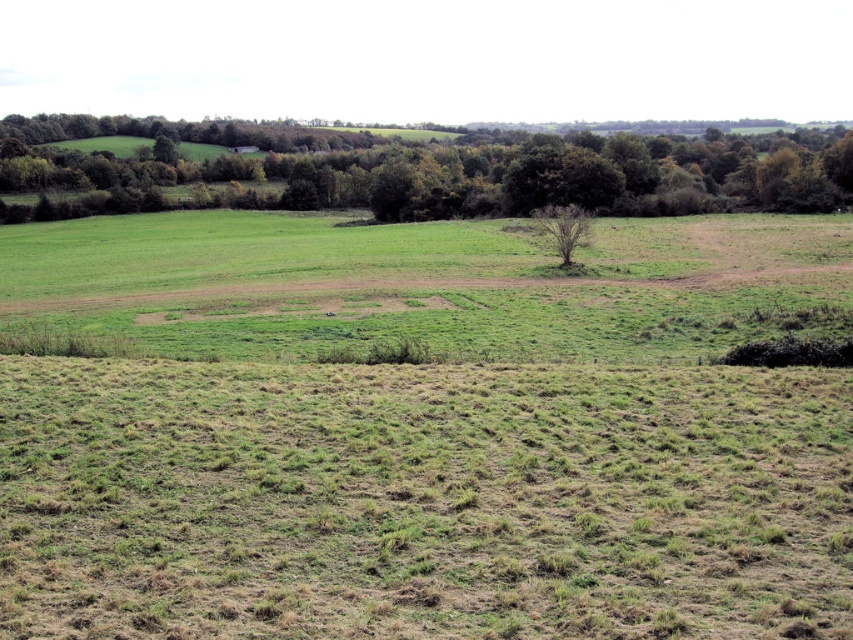
Question: Observing the image, what is the correct spatial positioning of green leafy tree at upper center in reference to bare brown tree at center?

Choices:
 (A) left
 (B) right

Answer: (B)

Question: Which point is closer to the camera?

Choices:
 (A) green leafy tree at upper center
 (B) bare brown tree at center

Answer: (B)

Question: Which point is farther to the camera?

Choices:
 (A) bare brown tree at center
 (B) green leafy tree at upper center

Answer: (B)

Question: Can you confirm if green leafy tree at upper center is bigger than bare brown tree at center?

Choices:
 (A) no
 (B) yes

Answer: (B)

Question: Is green leafy tree at upper center to the left of bare brown tree at center from the viewer's perspective?

Choices:
 (A) yes
 (B) no

Answer: (B)